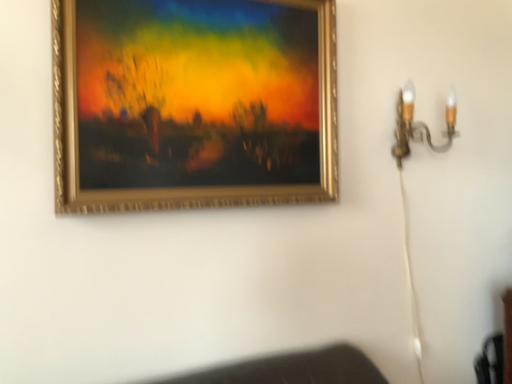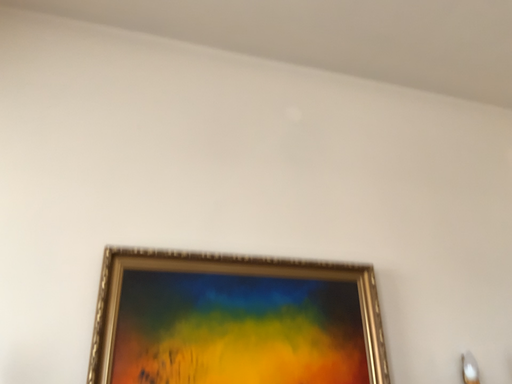
Question: How did the camera likely rotate when shooting the video?

Choices:
 (A) rotated upward
 (B) rotated downward

Answer: (A)